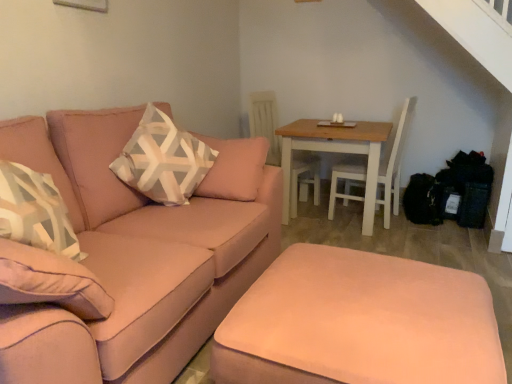
Question: Choose the correct answer: Is light brown wooden table at center right inside white wood swivel chair at center or outside it?

Choices:
 (A) inside
 (B) outside

Answer: (B)

Question: From the image's perspective, is light brown wooden table at center right above or below white wood swivel chair at center?

Choices:
 (A) above
 (B) below

Answer: (B)

Question: Estimate the real-world distances between objects in this image. Which object is closer to the white wood swivel chair at center?

Choices:
 (A) satin pink couch at left
 (B) light brown wooden table at center right
 (C) patterned fabric pillow at center-left
 (D) satin pink ottoman at lower center

Answer: (B)

Question: Which is nearer to the satin pink couch at left?

Choices:
 (A) satin pink ottoman at lower center
 (B) patterned fabric pillow at center-left
 (C) light brown wooden table at center right
 (D) white wood swivel chair at center

Answer: (B)